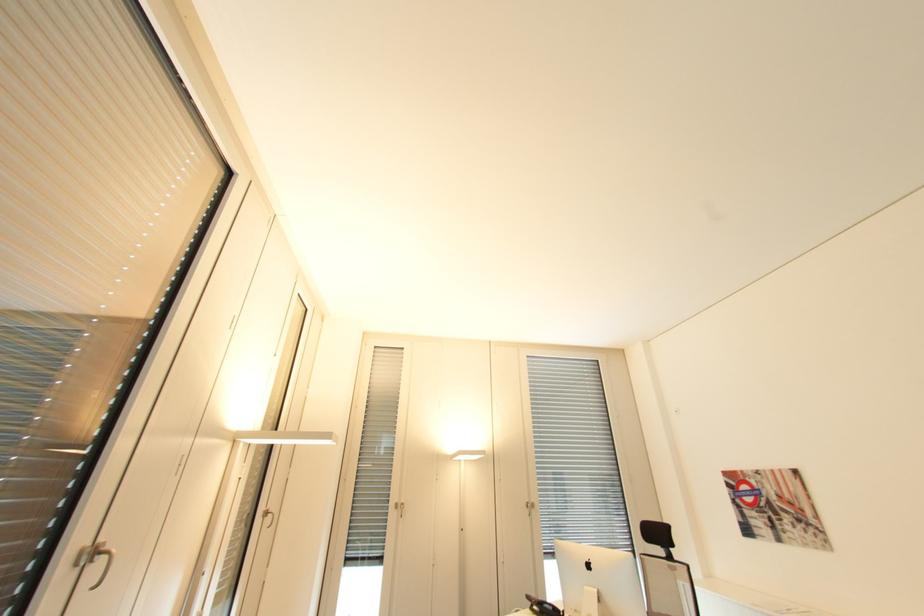
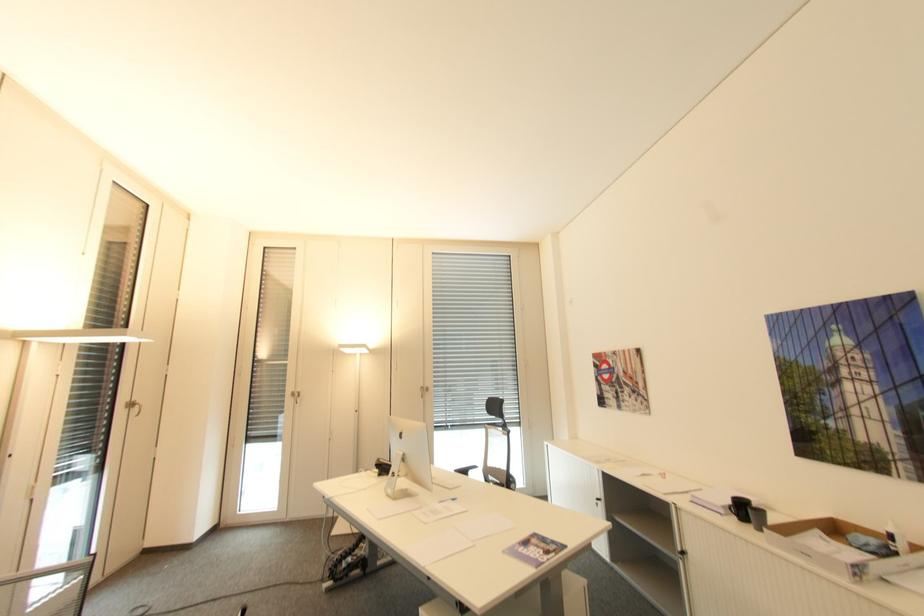
Where in the second image is the point corresponding to the point at 270,511 from the first image?

(131, 402)